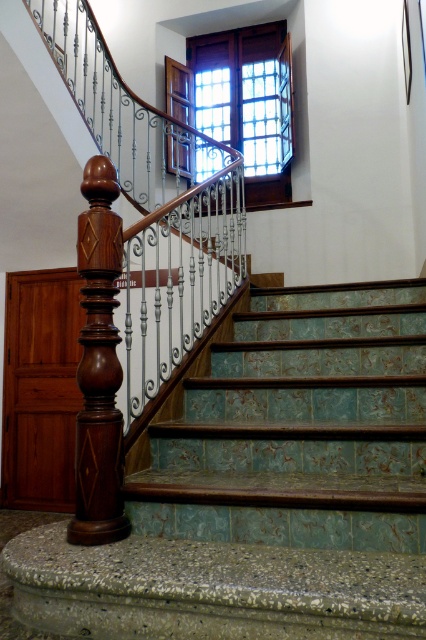
Question: Does green textured tile stairs at center come behind polished wood post at center?

Choices:
 (A) yes
 (B) no

Answer: (B)

Question: Does polished wood post at center have a smaller size compared to clear glass window at upper center?

Choices:
 (A) no
 (B) yes

Answer: (B)

Question: Which of the following is the farthest from the observer?

Choices:
 (A) (141, 515)
 (B) (100, 454)
 (C) (236, 118)

Answer: (C)

Question: Is green textured tile stairs at center bigger than clear glass window at upper center?

Choices:
 (A) no
 (B) yes

Answer: (A)

Question: Which point is farther from the camera taking this photo?

Choices:
 (A) click(x=290, y=115)
 (B) click(x=94, y=292)

Answer: (A)

Question: Which object is the farthest from the green textured tile stairs at center?

Choices:
 (A) polished wood post at center
 (B) clear glass window at upper center

Answer: (B)